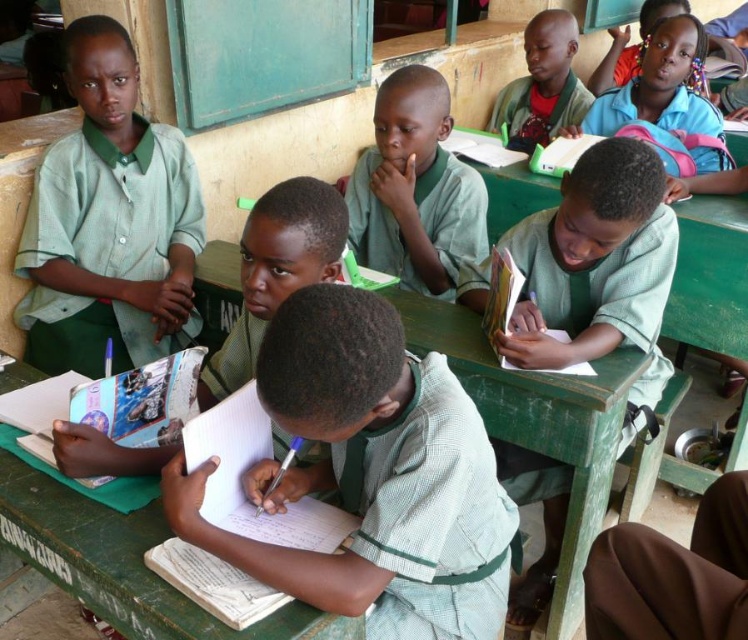
Who is more distant from viewer, (610, 266) or (536, 29)?

The point (536, 29) is behind.

Where is `green fabric shirt at center`? green fabric shirt at center is located at coordinates (597, 269).

Is point (398, 104) positioned before point (542, 45)?

Yes, it is in front of point (542, 45).

Between point (414, 252) and point (496, 109), which one is positioned in front?

Point (414, 252) is more forward.

Locate an element on the screen. This screenshot has width=748, height=640. green matte uniform at center is located at coordinates (414, 188).

Who is shorter, green striped shirt at center or green fabric shirt at center?

green striped shirt at center is shorter.

Image resolution: width=748 pixels, height=640 pixels. Describe the element at coordinates (370, 476) in the screenshot. I see `green striped shirt at center` at that location.

Is point (373, 413) positioned before point (603, 221)?

Yes, it is in front of point (603, 221).

Locate an element on the screen. green striped shirt at center is located at coordinates (370, 476).